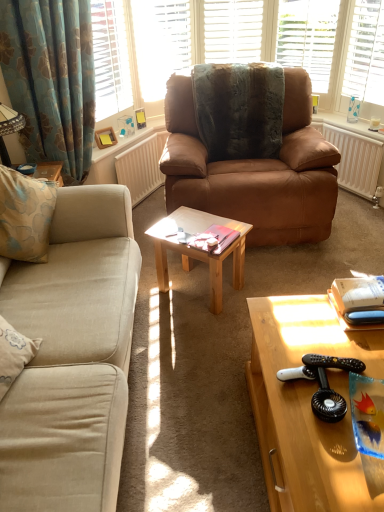
Image resolution: width=384 pixels, height=512 pixels. What are the coordinates of `free space to the left of wooden coffee table at lower right, the 2th coffee table viewed from the left` in the screenshot? It's located at (183, 426).